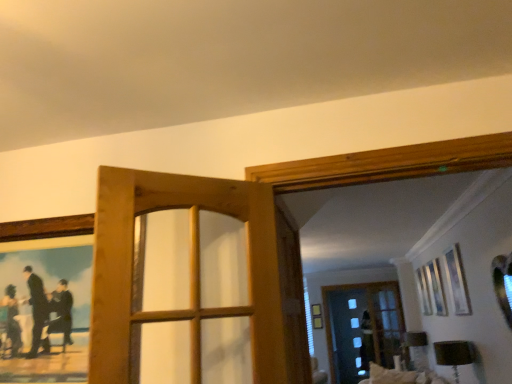
The width and height of the screenshot is (512, 384). What do you see at coordinates (190, 267) in the screenshot? I see `wooden door at center` at bounding box center [190, 267].

The image size is (512, 384). What do you see at coordinates (44, 313) in the screenshot?
I see `wooden picture frame at upper left` at bounding box center [44, 313].

At what (x,y) coordinates should I click in order to perform the action: click on wooden door at center. Please return your answer as a coordinate pair (x, y). The height and width of the screenshot is (384, 512). Looking at the image, I should click on (190, 267).

In the image, is transparent glass screen door at center positioned in front of or behind wooden door at center?

Visually, transparent glass screen door at center is located behind wooden door at center.

From a real-world perspective, does transparent glass screen door at center stand above wooden door at center?

No, from a real-world perspective, transparent glass screen door at center is not above wooden door at center.

Considering the relative sizes of transparent glass screen door at center and wooden door at center in the image provided, is transparent glass screen door at center wider than wooden door at center?

No.

Is point (287, 315) closer to viewer compared to point (269, 366)?

No, (287, 315) is further to viewer.

You are a GUI agent. You are given a task and a screenshot of the screen. Output one action in this format:
    pyautogui.click(x=<x>, y=<y>)
    Task: Click on the picture frame lying below the wooden door at center (from the image's perspective)
    
    Given the screenshot: What is the action you would take?
    pyautogui.click(x=44, y=313)

Between wooden door at center and wooden picture frame at upper left, which one has more height?

wooden door at center is taller.

From the image's perspective, would you say wooden door at center is positioned over wooden picture frame at upper left?

Indeed, from the image's perspective, wooden door at center is shown above wooden picture frame at upper left.

Looking at their sizes, would you say wooden door at center is wider or thinner than wooden picture frame at upper left?

wooden door at center is wider than wooden picture frame at upper left.

What are the coordinates of `picture frame to the left of wooden door at center` in the screenshot? It's located at (44, 313).

Is wooden picture frame at upper left positioned behind wooden door at center?

Yes, it is.

Based on the photo, considering the relative sizes of wooden picture frame at upper left and wooden door at center in the image provided, is wooden picture frame at upper left wider than wooden door at center?

No, wooden picture frame at upper left is not wider than wooden door at center.

Is point (27, 280) less distant than point (239, 313)?

No, it is not.

Is transparent glass screen door at center not inside wooden picture frame at upper left?

Yes, transparent glass screen door at center is not within wooden picture frame at upper left.

From a real-world perspective, relative to wooden picture frame at upper left, is transparent glass screen door at center vertically above or below?

In terms of real-world spatial position, transparent glass screen door at center is below wooden picture frame at upper left.

Considering the positions of objects transparent glass screen door at center and wooden picture frame at upper left in the image provided, who is behind, transparent glass screen door at center or wooden picture frame at upper left?

Positioned behind is transparent glass screen door at center.

Is transparent glass screen door at center next to wooden picture frame at upper left?

No.

Which of these two, wooden door at center or transparent glass screen door at center, is bigger?

Bigger between the two is transparent glass screen door at center.

Which object is thinner, wooden door at center or transparent glass screen door at center?

With smaller width is transparent glass screen door at center.

Considering the positions of point (274, 234) and point (297, 330), is point (274, 234) closer or farther from the camera than point (297, 330)?

Point (274, 234) is positioned closer to the camera compared to point (297, 330).

From the image's perspective, which is below, wooden door at center or transparent glass screen door at center?

transparent glass screen door at center.

From the image's perspective, is wooden picture frame at upper left above or below transparent glass screen door at center?

wooden picture frame at upper left is situated higher than transparent glass screen door at center in the image.

Would you say wooden picture frame at upper left contains transparent glass screen door at center?

No, transparent glass screen door at center is located outside of wooden picture frame at upper left.

Considering the relative positions of wooden picture frame at upper left and transparent glass screen door at center in the image provided, is wooden picture frame at upper left to the left of transparent glass screen door at center from the viewer's perspective?

Yes, wooden picture frame at upper left is to the left of transparent glass screen door at center.

Is wooden picture frame at upper left in front of or behind transparent glass screen door at center in the image?

Visually, wooden picture frame at upper left is located in front of transparent glass screen door at center.

Find the location of a particular element. This screenshot has width=512, height=384. door above the transparent glass screen door at center (from a real-world perspective) is located at coordinates (190, 267).

The width and height of the screenshot is (512, 384). I want to click on picture frame below the wooden door at center (from the image's perspective), so click(44, 313).

Estimate the real-world distances between objects in this image. Which object is further from wooden door at center, wooden picture frame at upper left or transparent glass screen door at center?

wooden picture frame at upper left lies further to wooden door at center than the other object.

Considering their positions, is transparent glass screen door at center positioned further to wooden picture frame at upper left than wooden door at center?

The object further to wooden picture frame at upper left is transparent glass screen door at center.

Which object lies nearer to the anchor point wooden door at center, transparent glass screen door at center or wooden picture frame at upper left?

transparent glass screen door at center lies closer to wooden door at center than the other object.

When comparing their distances from transparent glass screen door at center, does wooden door at center or wooden picture frame at upper left seem closer?

Among the two, wooden door at center is located nearer to transparent glass screen door at center.

Based on their spatial positions, is wooden door at center or transparent glass screen door at center closer to wooden picture frame at upper left?

wooden door at center is positioned closer to the anchor wooden picture frame at upper left.

Estimate the real-world distances between objects in this image. Which object is further from transparent glass screen door at center, wooden picture frame at upper left or wooden door at center?

Based on the image, wooden picture frame at upper left appears to be further to transparent glass screen door at center.

Locate an element on the screen. door between wooden picture frame at upper left and transparent glass screen door at center from left to right is located at coordinates (190, 267).